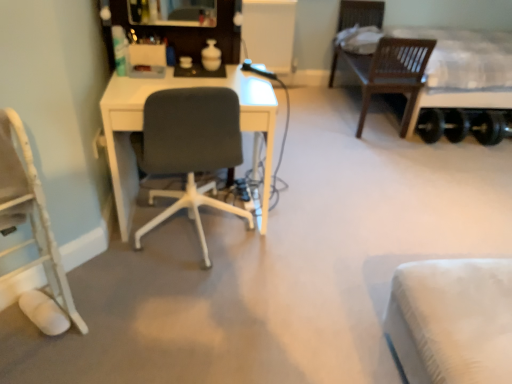
Locate an element on the screen. This screenshot has height=384, width=512. matte gray chair at center, acting as the second chair starting from the left is located at coordinates (189, 149).

What are the coordinates of `wooden bed at right` in the screenshot? It's located at (462, 71).

Where is `matte gray chair at center, acting as the second chair starting from the left`? matte gray chair at center, acting as the second chair starting from the left is located at coordinates (189, 149).

Can you confirm if white fabric chair at lower left, positioned as the 1th chair in left-to-right order, is thinner than wooden bed at right?

Correct, the width of white fabric chair at lower left, positioned as the 1th chair in left-to-right order, is less than that of wooden bed at right.

Locate an element on the screen. This screenshot has height=384, width=512. bed that is above the white fabric chair at lower left, the 2th chair when ordered from right to left (from the image's perspective) is located at coordinates (462, 71).

Is wooden bed at right a part of white fabric chair at lower left, the 2th chair when ordered from right to left?

Definitely not — wooden bed at right is not inside white fabric chair at lower left, the 2th chair when ordered from right to left.

From the image's perspective, is wooden bed at right positioned above or below matte gray chair at center, which is the 1th chair from right to left?

Based on their image positions, wooden bed at right is located above matte gray chair at center, which is the 1th chair from right to left.

From the picture: Which object is wider, wooden bed at right or matte gray chair at center, acting as the second chair starting from the left?

wooden bed at right.

Can we say wooden bed at right lies outside matte gray chair at center, acting as the second chair starting from the left?

wooden bed at right lies outside matte gray chair at center, acting as the second chair starting from the left,'s area.

Could you tell me if matte gray chair at center, which is the 1th chair from right to left, is turned towards wooden bed at right?

No, matte gray chair at center, which is the 1th chair from right to left, is not facing towards wooden bed at right.

Does matte gray chair at center, acting as the second chair starting from the left, have a greater width compared to wooden bed at right?

Incorrect, the width of matte gray chair at center, acting as the second chair starting from the left, does not surpass that of wooden bed at right.

Does matte gray chair at center, acting as the second chair starting from the left, appear on the right side of wooden bed at right?

No, matte gray chair at center, acting as the second chair starting from the left, is not to the right of wooden bed at right.

From the image's perspective, is matte gray chair at center, which is the 1th chair from right to left, positioned above or below wooden bed at right?

matte gray chair at center, which is the 1th chair from right to left, is below wooden bed at right.

Based on the photo, is wooden bed at right taller or shorter than white fabric chair at lower left, the 2th chair when ordered from right to left?

wooden bed at right is taller than white fabric chair at lower left, the 2th chair when ordered from right to left.

From a real-world perspective, which is physically above, wooden bed at right or white fabric chair at lower left, positioned as the 1th chair in left-to-right order?

In real-world perspective, wooden bed at right is above.

Considering the positions of objects wooden bed at right and white fabric chair at lower left, the 2th chair when ordered from right to left, in the image provided, who is behind, wooden bed at right or white fabric chair at lower left, the 2th chair when ordered from right to left,?

wooden bed at right.

The width and height of the screenshot is (512, 384). In the image, there is a white fabric chair at lower left, the 2th chair when ordered from right to left. Identify the location of bed above it (from the image's perspective). (462, 71).

Is matte gray chair at center, which is the 1th chair from right to left, positioned with its back to white fabric chair at lower left, the 2th chair when ordered from right to left?

That's not correct — matte gray chair at center, which is the 1th chair from right to left, is not looking away from white fabric chair at lower left, the 2th chair when ordered from right to left.

The image size is (512, 384). In the image, there is a matte gray chair at center, acting as the second chair starting from the left. In order to click on chair below it (from the image's perspective) in this screenshot , I will do `click(30, 213)`.

Considering the positions of objects matte gray chair at center, which is the 1th chair from right to left, and white fabric chair at lower left, the 2th chair when ordered from right to left, in the image provided, who is in front, matte gray chair at center, which is the 1th chair from right to left, or white fabric chair at lower left, the 2th chair when ordered from right to left,?

white fabric chair at lower left, the 2th chair when ordered from right to left, is closer to the camera.

Is white fabric chair at lower left, the 2th chair when ordered from right to left, surrounded by matte gray chair at center, which is the 1th chair from right to left?

No, white fabric chair at lower left, the 2th chair when ordered from right to left, is not surrounded by matte gray chair at center, which is the 1th chair from right to left.

Based on their positions, is white fabric chair at lower left, positioned as the 1th chair in left-to-right order, located to the left or right of matte gray chair at center, which is the 1th chair from right to left?

Clearly, white fabric chair at lower left, positioned as the 1th chair in left-to-right order, is on the left of matte gray chair at center, which is the 1th chair from right to left, in the image.

Is the depth of white fabric chair at lower left, positioned as the 1th chair in left-to-right order, greater than that of matte gray chair at center, which is the 1th chair from right to left?

No.

Does white fabric chair at lower left, positioned as the 1th chair in left-to-right order, have a lesser width compared to matte gray chair at center, which is the 1th chair from right to left?

Indeed, white fabric chair at lower left, positioned as the 1th chair in left-to-right order, has a lesser width compared to matte gray chair at center, which is the 1th chair from right to left.

Does white fabric chair at lower left, positioned as the 1th chair in left-to-right order, have a smaller size compared to matte gray chair at center, which is the 1th chair from right to left?

Correct, white fabric chair at lower left, positioned as the 1th chair in left-to-right order, occupies less space than matte gray chair at center, which is the 1th chair from right to left.

Find the location of a particular element. The width and height of the screenshot is (512, 384). bed on the right of white fabric chair at lower left, the 2th chair when ordered from right to left is located at coordinates (462, 71).

You are a GUI agent. You are given a task and a screenshot of the screen. Output one action in this format:
    pyautogui.click(x=<x>, y=<y>)
    Task: Click on the chair that is the 1st object located below the wooden bed at right (from the image's perspective)
    The width and height of the screenshot is (512, 384).
    Given the screenshot: What is the action you would take?
    pyautogui.click(x=189, y=149)

When comparing their distances from white fabric chair at lower left, the 2th chair when ordered from right to left, does wooden bed at right or matte gray chair at center, which is the 1th chair from right to left, seem further?

wooden bed at right is further to white fabric chair at lower left, the 2th chair when ordered from right to left.

Based on their spatial positions, is white fabric chair at lower left, the 2th chair when ordered from right to left, or matte gray chair at center, acting as the second chair starting from the left, closer to wooden bed at right?

Based on the image, matte gray chair at center, acting as the second chair starting from the left, appears to be nearer to wooden bed at right.

Consider the image. From the image, which object appears to be nearer to wooden bed at right, matte gray chair at center, which is the 1th chair from right to left, or white fabric chair at lower left, positioned as the 1th chair in left-to-right order?

matte gray chair at center, which is the 1th chair from right to left, is closer to wooden bed at right.

Looking at the image, which one is located further to matte gray chair at center, which is the 1th chair from right to left, white fabric chair at lower left, positioned as the 1th chair in left-to-right order, or wooden bed at right?

wooden bed at right is further to matte gray chair at center, which is the 1th chair from right to left.

Looking at the image, which one is located closer to white fabric chair at lower left, positioned as the 1th chair in left-to-right order, matte gray chair at center, acting as the second chair starting from the left, or wooden bed at right?

matte gray chair at center, acting as the second chair starting from the left, is closer to white fabric chair at lower left, positioned as the 1th chair in left-to-right order.

Considering their positions, is wooden bed at right positioned further to matte gray chair at center, acting as the second chair starting from the left, than white fabric chair at lower left, the 2th chair when ordered from right to left?

The object further to matte gray chair at center, acting as the second chair starting from the left, is wooden bed at right.

I want to click on chair between white fabric chair at lower left, the 2th chair when ordered from right to left, and wooden bed at right from left to right, so click(x=189, y=149).